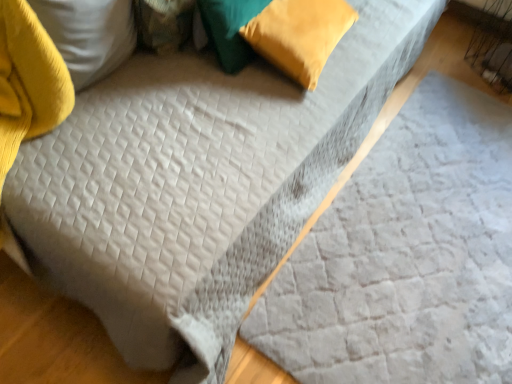
Question: Does gray quilted sheet at center lie in front of velvet green pillow at upper center, which ranks as the second pillow in right-to-left order?

Choices:
 (A) no
 (B) yes

Answer: (B)

Question: Could you tell me if gray quilted sheet at center is turned towards velvet green pillow at upper center, the second pillow positioned from the left?

Choices:
 (A) yes
 (B) no

Answer: (B)

Question: Is velvet green pillow at upper center, the second pillow positioned from the left, located within gray quilted sheet at center?

Choices:
 (A) no
 (B) yes

Answer: (A)

Question: From the image's perspective, is gray quilted sheet at center above velvet green pillow at upper center, the second pillow positioned from the left?

Choices:
 (A) no
 (B) yes

Answer: (A)

Question: Does gray quilted sheet at center have a greater height compared to velvet green pillow at upper center, the second pillow positioned from the left?

Choices:
 (A) yes
 (B) no

Answer: (B)

Question: Considering the positions of velvet yellow pillow at upper right, the third pillow in the left-to-right sequence, and velvet green pillow at upper center, which ranks as the second pillow in right-to-left order, in the image, is velvet yellow pillow at upper right, the third pillow in the left-to-right sequence, taller or shorter than velvet green pillow at upper center, which ranks as the second pillow in right-to-left order,?

Choices:
 (A) short
 (B) tall

Answer: (A)

Question: From a real-world perspective, is velvet yellow pillow at upper right, marked as the 1th pillow in a right-to-left arrangement, physically located above or below velvet green pillow at upper center, which ranks as the second pillow in right-to-left order?

Choices:
 (A) above
 (B) below

Answer: (B)

Question: Considering the positions of velvet yellow pillow at upper right, the third pillow in the left-to-right sequence, and velvet green pillow at upper center, which ranks as the second pillow in right-to-left order, in the image, is velvet yellow pillow at upper right, the third pillow in the left-to-right sequence, wider or thinner than velvet green pillow at upper center, which ranks as the second pillow in right-to-left order,?

Choices:
 (A) thin
 (B) wide

Answer: (B)

Question: Is velvet yellow pillow at upper right, the third pillow in the left-to-right sequence, situated inside velvet green pillow at upper center, the second pillow positioned from the left, or outside?

Choices:
 (A) inside
 (B) outside

Answer: (B)

Question: Considering the positions of velvet green pillow at upper left, which ranks as the 3th pillow in right-to-left order, and gray quilted sheet at center in the image, is velvet green pillow at upper left, which ranks as the 3th pillow in right-to-left order, taller or shorter than gray quilted sheet at center?

Choices:
 (A) tall
 (B) short

Answer: (A)

Question: Is velvet green pillow at upper left, which appears as the 1th pillow when viewed from the left, situated inside gray quilted sheet at center or outside?

Choices:
 (A) outside
 (B) inside

Answer: (A)

Question: From the image's perspective, relative to gray quilted sheet at center, is velvet green pillow at upper left, which appears as the 1th pillow when viewed from the left, above or below?

Choices:
 (A) below
 (B) above

Answer: (B)

Question: From a real-world perspective, is velvet green pillow at upper left, which appears as the 1th pillow when viewed from the left, positioned above or below gray quilted sheet at center?

Choices:
 (A) below
 (B) above

Answer: (B)

Question: Would you say velvet yellow pillow at upper right, marked as the 1th pillow in a right-to-left arrangement, is inside or outside gray quilted sheet at center?

Choices:
 (A) outside
 (B) inside

Answer: (A)

Question: Visually, is velvet yellow pillow at upper right, marked as the 1th pillow in a right-to-left arrangement, positioned to the left or to the right of gray quilted sheet at center?

Choices:
 (A) right
 (B) left

Answer: (B)